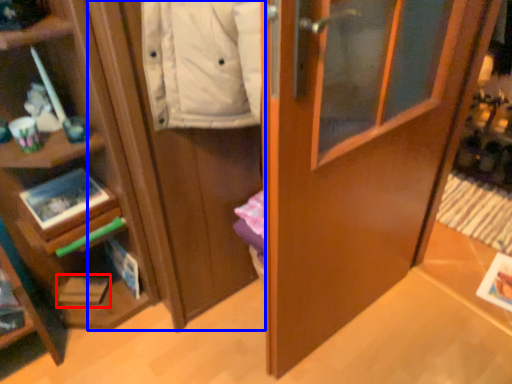
Question: Which of the following is the farthest to the observer, magazine (highlighted by a red box) or cabinetry (highlighted by a blue box)?

Choices:
 (A) magazine
 (B) cabinetry

Answer: (A)